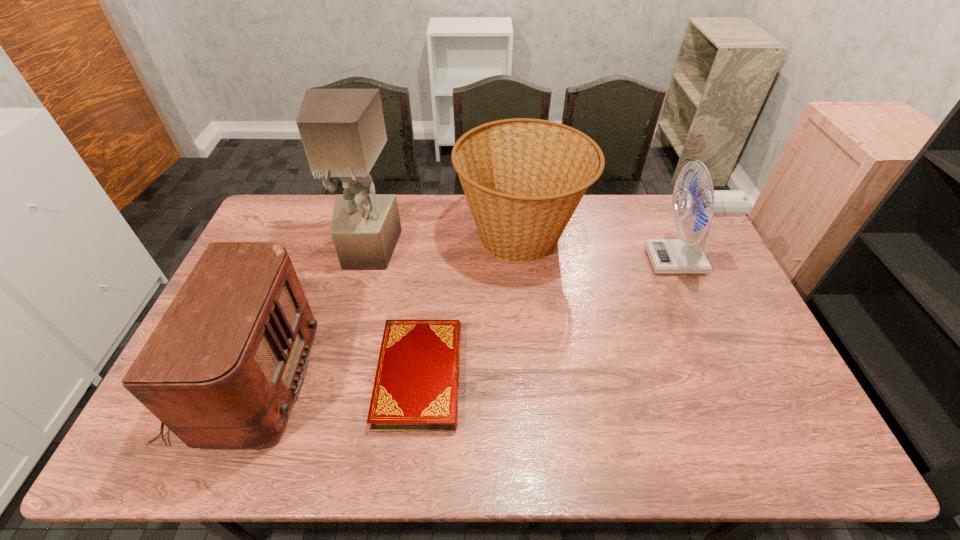
At what (x,y) coordinates should I click in order to perform the action: click on free space in the image that satisfies the following two spatial constraints: 1. on the cover of the shortest object; 2. on the front panel of the radio receiver. Please return your answer as a coordinate pair (x, y). The image size is (960, 540). Looking at the image, I should click on (420, 379).

Locate an element on the screen. The width and height of the screenshot is (960, 540). free space in the image that satisfies the following two spatial constraints: 1. on the cover of the hardback book; 2. on the front panel of the radio receiver is located at coordinates (420, 379).

The image size is (960, 540). What are the coordinates of `vacant position in the image that satisfies the following two spatial constraints: 1. on the cover of the shortest object; 2. on the front panel of the radio receiver` in the screenshot? It's located at (420, 379).